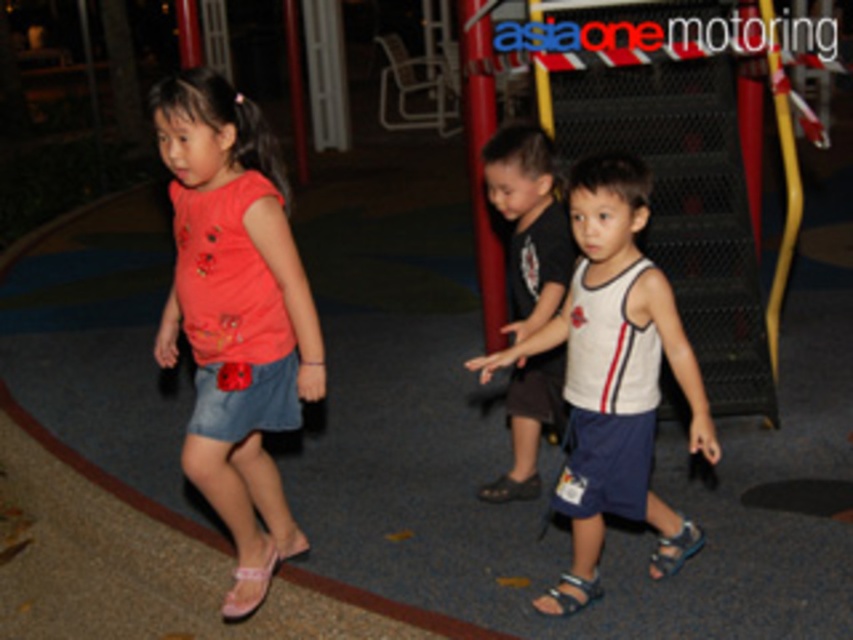
Can you confirm if pink fabric sandal at lower left is positioned to the right of light brown leather sandal at lower center?

In fact, pink fabric sandal at lower left is to the left of light brown leather sandal at lower center.

I want to click on pink fabric sandal at lower left, so click(x=248, y=588).

This screenshot has width=853, height=640. What are the coordinates of `pink fabric sandal at lower left` in the screenshot? It's located at (248, 588).

Between white cotton shirt at center and light brown leather sandal at lower center, which one appears on the right side from the viewer's perspective?

light brown leather sandal at lower center

Between point (525, 298) and point (570, 580), which one is positioned in front?

Point (570, 580) is in front.

Is point (543, 307) closer to viewer compared to point (566, 602)?

No, it is behind (566, 602).

The width and height of the screenshot is (853, 640). In order to click on white cotton shirt at center in this screenshot , I will do `click(529, 224)`.

Does matte coral t-shirt at center have a greater height compared to white cotton shirt at center?

Indeed, matte coral t-shirt at center has a greater height compared to white cotton shirt at center.

Identify the location of matte coral t-shirt at center. The height and width of the screenshot is (640, 853). (235, 314).

Where is `matte coral t-shirt at center`? Image resolution: width=853 pixels, height=640 pixels. matte coral t-shirt at center is located at coordinates (235, 314).